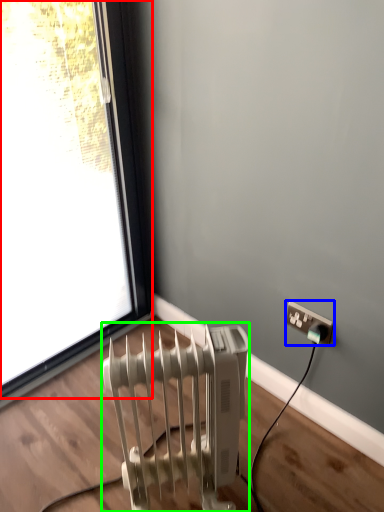
Question: Based on their relative distances, which object is farther from window (highlighted by a red box)? Choose from power plugs and sockets (highlighted by a blue box) and radiator (highlighted by a green box).

Choices:
 (A) power plugs and sockets
 (B) radiator

Answer: (A)